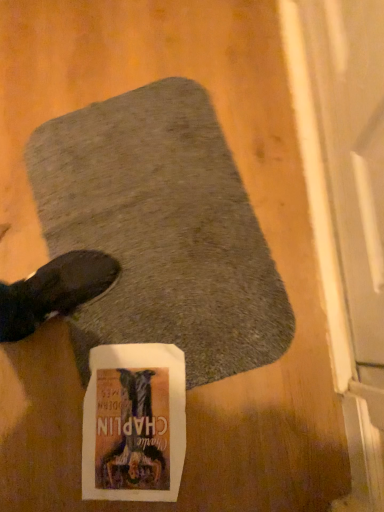
Question: From a real-world perspective, is white paper flyer at center over gray soft rug at center?

Choices:
 (A) yes
 (B) no

Answer: (B)

Question: From the image's perspective, is white paper flyer at center located beneath gray soft rug at center?

Choices:
 (A) no
 (B) yes

Answer: (B)

Question: Is white paper flyer at center oriented away from gray soft rug at center?

Choices:
 (A) yes
 (B) no

Answer: (B)

Question: Does white paper flyer at center come behind gray soft rug at center?

Choices:
 (A) no
 (B) yes

Answer: (B)

Question: Is white paper flyer at center in contact with gray soft rug at center?

Choices:
 (A) no
 (B) yes

Answer: (A)

Question: Is white paper flyer at center not within gray soft rug at center?

Choices:
 (A) yes
 (B) no

Answer: (B)

Question: Is gray soft rug at center bigger than white paper flyer at center?

Choices:
 (A) no
 (B) yes

Answer: (B)

Question: Is the position of gray soft rug at center more distant than that of white paper flyer at center?

Choices:
 (A) yes
 (B) no

Answer: (B)

Question: Is gray soft rug at center shorter than white paper flyer at center?

Choices:
 (A) no
 (B) yes

Answer: (A)

Question: From the image's perspective, is gray soft rug at center under white paper flyer at center?

Choices:
 (A) no
 (B) yes

Answer: (A)

Question: Does gray soft rug at center appear on the left side of white paper flyer at center?

Choices:
 (A) no
 (B) yes

Answer: (A)

Question: From a real-world perspective, is gray soft rug at center positioned over white paper flyer at center based on gravity?

Choices:
 (A) yes
 (B) no

Answer: (A)

Question: Would you say white paper flyer at center is inside or outside gray soft rug at center?

Choices:
 (A) inside
 (B) outside

Answer: (A)